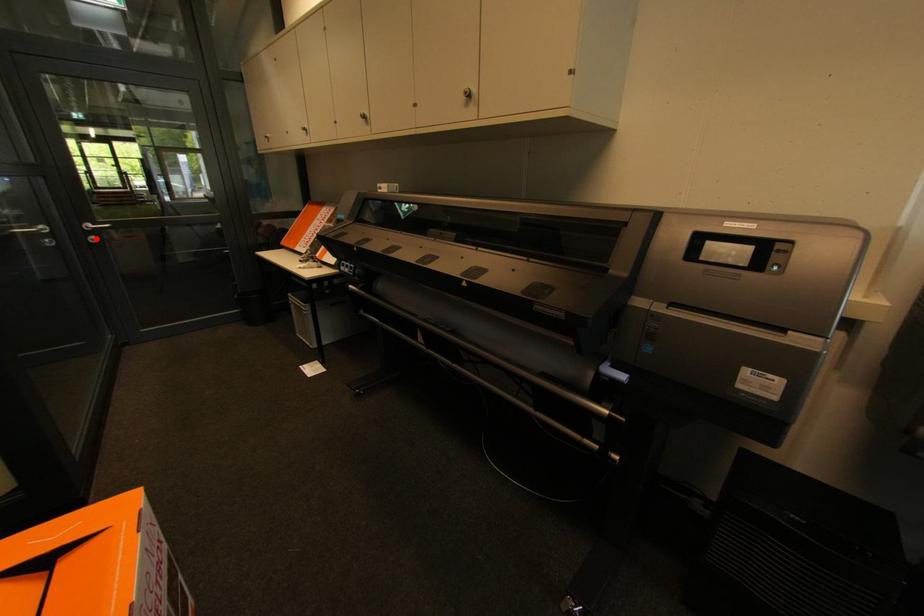
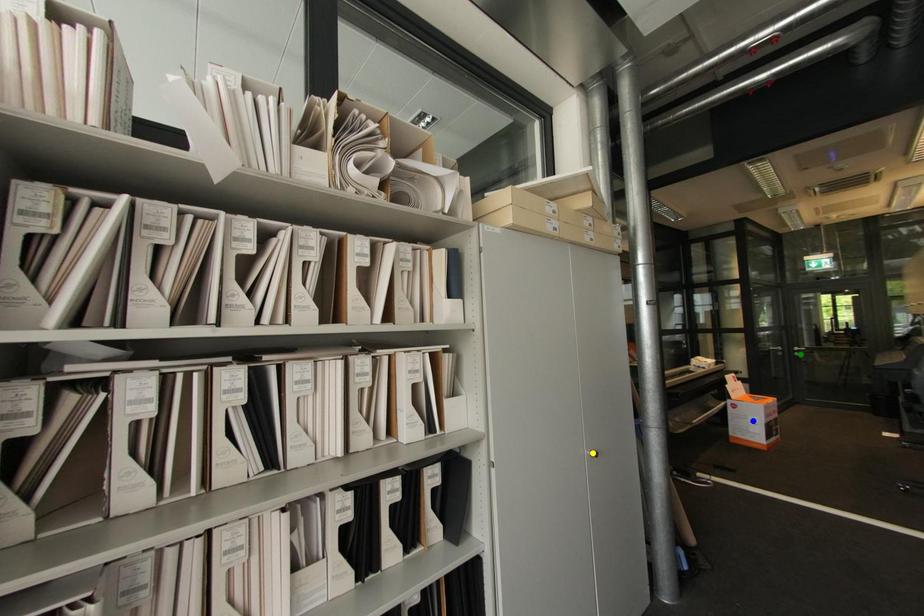
Question: I am providing you with two images of the same scene from different viewpoints. A red point is marked on the first image. You are given multiple points on the second image. Which spot in image 2 lines up with the point in image 1?

Choices:
 (A) yellow point
 (B) green point
 (C) blue point

Answer: (B)